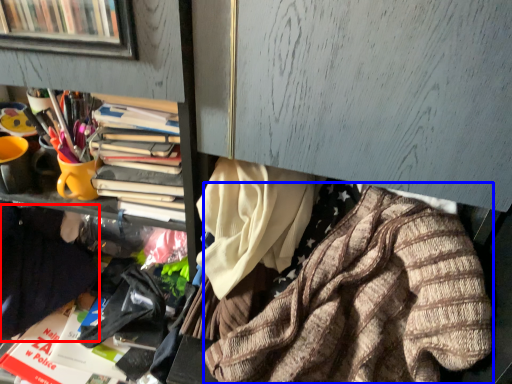
Question: Which object is closer to the camera taking this photo, clothing (highlighted by a red box) or clothing (highlighted by a blue box)?

Choices:
 (A) clothing
 (B) clothing

Answer: (B)